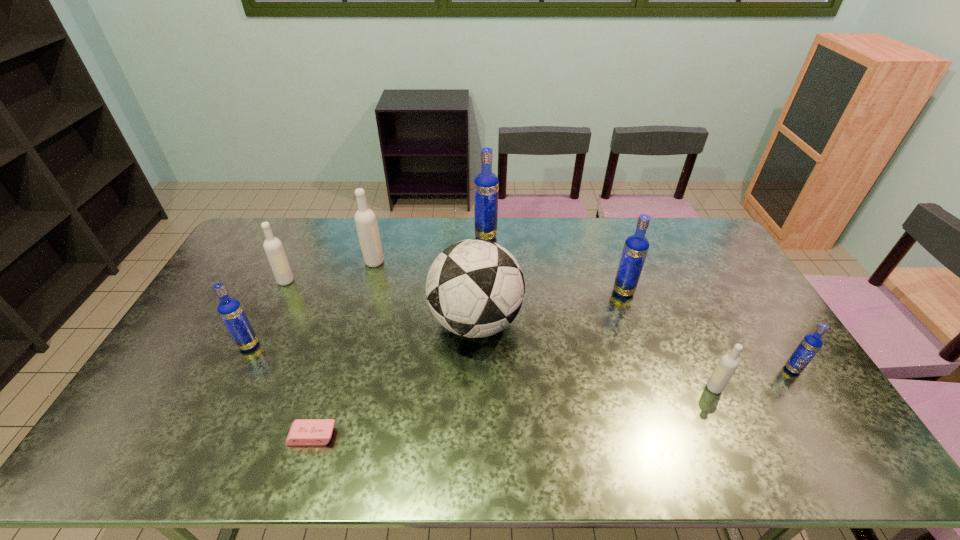
Locate an element on the screen. The height and width of the screenshot is (540, 960). vacant space located 0.300m on the surface of the soccer ball where the brand logo is visible is located at coordinates (618, 322).

Identify the location of vacant space located on the right of the third farthest blue vodka. This screenshot has width=960, height=540. (302, 345).

Locate an element on the screen. free location located 0.110m on the back of the second nearest white vodka is located at coordinates (299, 255).

The image size is (960, 540). I want to click on free region located 0.100m on the front of the smallest blue vodka, so click(817, 407).

Identify the location of vacant space situated 0.160m on the right of the second vodka from right to left. (780, 388).

You are a GUI agent. You are given a task and a screenshot of the screen. Output one action in this format:
    pyautogui.click(x=<x>, y=<y>)
    Task: Click on the free region located on the right of the eraser
    The width and height of the screenshot is (960, 540).
    Given the screenshot: What is the action you would take?
    pyautogui.click(x=393, y=436)

Find the location of `object positioned at the far edge`. object positioned at the far edge is located at coordinates (486, 184).

This screenshot has width=960, height=540. I want to click on object at the near edge, so click(x=304, y=432).

In order to click on object located in the right edge section of the desktop in this screenshot , I will do click(x=810, y=345).

Find the location of `blank space at the far edge of the desktop`. blank space at the far edge of the desktop is located at coordinates (386, 234).